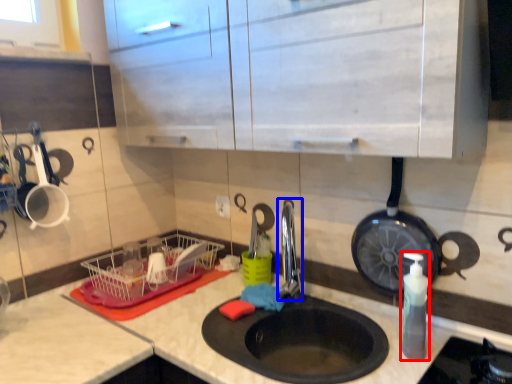
Question: Which of the following is the closest to the observer, soap dispenser (highlighted by a red box) or faucet (highlighted by a blue box)?

Choices:
 (A) soap dispenser
 (B) faucet

Answer: (A)